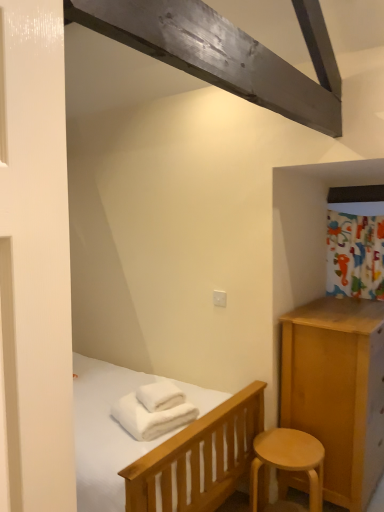
The width and height of the screenshot is (384, 512). I want to click on free space above light wood stool at lower right (from a real-world perspective), so click(x=283, y=443).